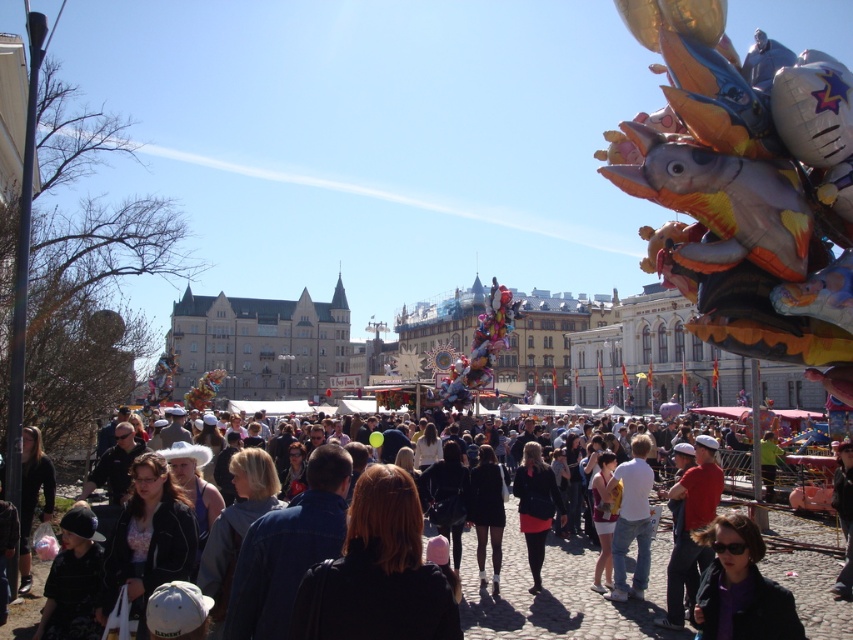
Describe the element at coordinates (740, 586) in the screenshot. The image size is (853, 640). I see `purple matte jacket at lower right` at that location.

Can you confirm if purple matte jacket at lower right is positioned above red shirt at center?

Correct, purple matte jacket at lower right is located above red shirt at center.

Measure the distance between point (722, 582) and camera.

They are 41.73 meters apart.

You are a GUI agent. You are given a task and a screenshot of the screen. Output one action in this format:
    pyautogui.click(x=<x>, y=<y>)
    Task: Click on the purple matte jacket at lower right
    
    Given the screenshot: What is the action you would take?
    pyautogui.click(x=740, y=586)

Is point (471, 608) less distant than point (553, 502)?

Yes, point (471, 608) is in front of point (553, 502).

Is dark brown leather jacket at center below matte black jacket at center?

Yes.

Which is behind, point (433, 529) or point (552, 516)?

Positioned behind is point (433, 529).

This screenshot has width=853, height=640. I want to click on dark brown leather jacket at center, so click(556, 592).

Does dark brown hair at center lie behind red shirt at center?

That is False.

Between dark brown hair at center and red shirt at center, which one is positioned higher?

dark brown hair at center is higher up.

You are a GUI agent. You are given a task and a screenshot of the screen. Output one action in this format:
    pyautogui.click(x=<x>, y=<y>)
    Task: Click on the dark brown hair at center
    
    Given the screenshot: What is the action you would take?
    pyautogui.click(x=376, y=572)